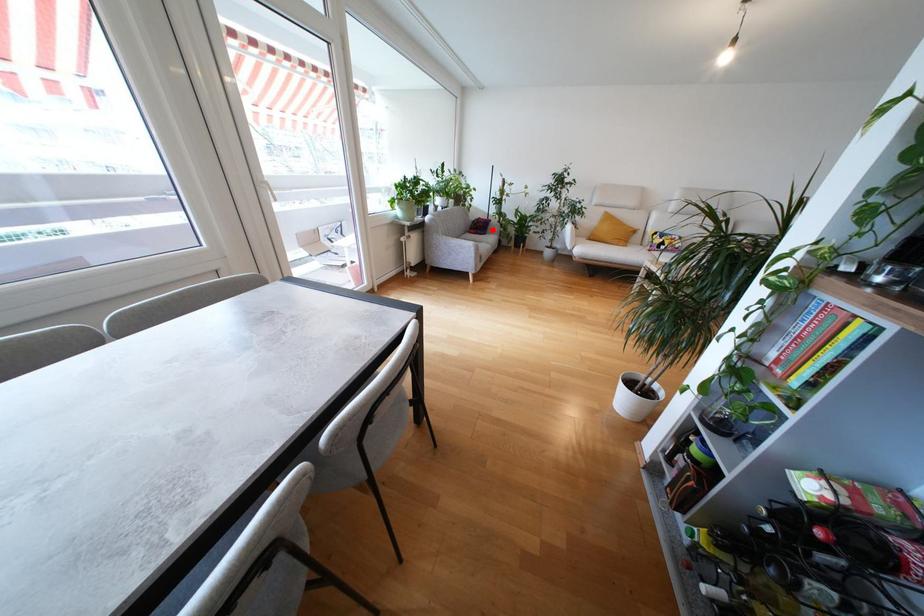
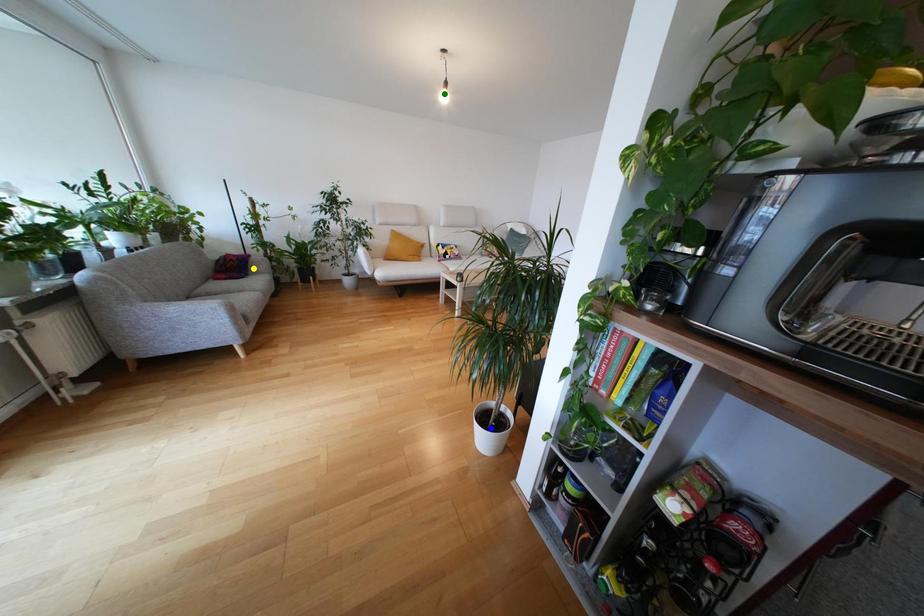
Question: I am providing you with two images of the same scene from different viewpoints. A red point is marked on the first image. You are given multiple points on the second image. Which point in image 2 represents the same 3d spot as the red point in image 1?

Choices:
 (A) yellow point
 (B) green point
 (C) blue point

Answer: (A)